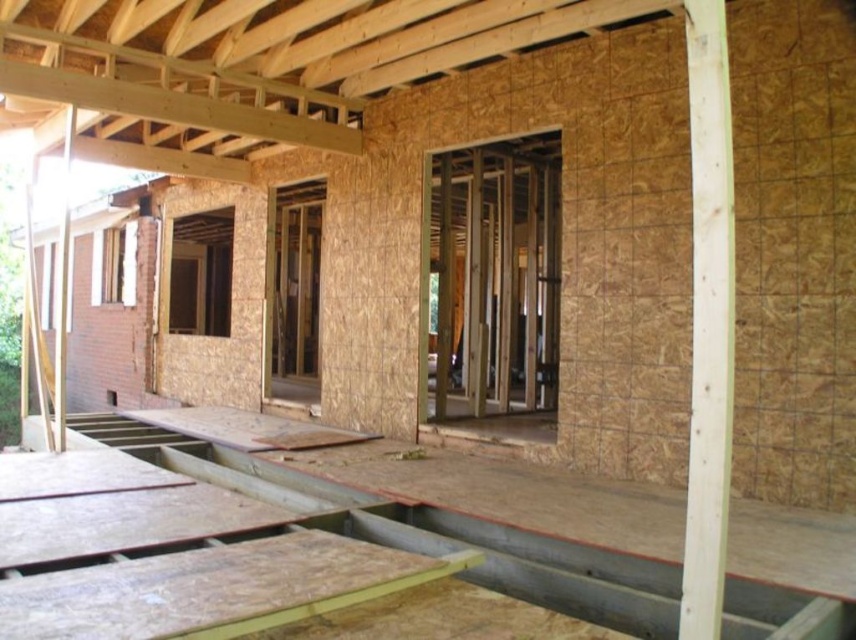
Question: Does wooden floorboards at center have a smaller size compared to light brown wood at right?

Choices:
 (A) no
 (B) yes

Answer: (A)

Question: Does wooden floorboards at center have a lesser width compared to light brown wood at right?

Choices:
 (A) no
 (B) yes

Answer: (A)

Question: Which point is closer to the camera?

Choices:
 (A) light brown wood at right
 (B) wooden floorboards at center

Answer: (A)

Question: Is wooden floorboards at center below light brown wood at right?

Choices:
 (A) no
 (B) yes

Answer: (B)

Question: Which point is farther to the camera?

Choices:
 (A) (703, 620)
 (B) (34, 576)

Answer: (B)